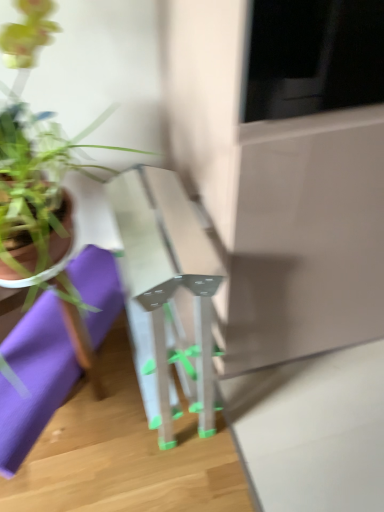
Based on the photo, what is the approximate width of purple fabric at lower left?

purple fabric at lower left is 24.66 inches in width.

Image resolution: width=384 pixels, height=512 pixels. Describe the element at coordinates (34, 379) in the screenshot. I see `purple fabric at lower left` at that location.

What are the coordinates of `transparent plastic table at center` in the screenshot? It's located at pyautogui.click(x=169, y=283).

Is purple fabric at lower left surrounding transparent plastic table at center?

No, transparent plastic table at center is not surrounded by purple fabric at lower left.

Is point (94, 319) positioned before point (196, 332)?

No, it is behind (196, 332).

Considering the relative sizes of purple fabric at lower left and transparent plastic table at center in the image provided, is purple fabric at lower left smaller than transparent plastic table at center?

Yes.

How many degrees apart are the facing directions of purple fabric at lower left and transparent plastic table at center?

The facing directions of purple fabric at lower left and transparent plastic table at center are 36.9 degrees apart.

Considering the sizes of objects green matte plant pot at left and transparent plastic table at center in the image provided, who is taller, green matte plant pot at left or transparent plastic table at center?

Standing taller between the two is transparent plastic table at center.

Would you say transparent plastic table at center is part of green matte plant pot at left's contents?

No, transparent plastic table at center is located outside of green matte plant pot at left.

How many degrees apart are the facing directions of green matte plant pot at left and transparent plastic table at center?

The angle between the facing direction of green matte plant pot at left and the facing direction of transparent plastic table at center is 0.475 degrees.

At what (x,y) coordinates should I click in order to perform the action: click on houseplant above the transparent plastic table at center (from the image's perspective). Please return your answer as a coordinate pair (x, y). This screenshot has width=384, height=512. Looking at the image, I should click on (103, 78).

Is point (207, 383) closer or farther from the camera than point (80, 124)?

Point (207, 383) is closer to the camera than point (80, 124).

In the image, is transparent plastic table at center positioned in front of or behind green matte plant pot at left?

transparent plastic table at center is behind green matte plant pot at left.

Considering the relative sizes of transparent plastic table at center and green matte plant pot at left in the image provided, is transparent plastic table at center smaller than green matte plant pot at left?

No.

In the scene shown: Is transparent plastic table at center facing away from green matte plant pot at left?

transparent plastic table at center is not turned away from green matte plant pot at left.

Looking at this image, considering the relative sizes of transparent plastic table at center and purple fabric at lower left in the image provided, is transparent plastic table at center taller than purple fabric at lower left?

Yes.

Is the surface of transparent plastic table at center in direct contact with purple fabric at lower left?

No, transparent plastic table at center is not next to purple fabric at lower left.

Which object is wider, transparent plastic table at center or purple fabric at lower left?

Wider between the two is transparent plastic table at center.

Is transparent plastic table at center at the right side of purple fabric at lower left?

Indeed, transparent plastic table at center is positioned on the right side of purple fabric at lower left.

Choose the correct answer: Is purple fabric at lower left inside green matte plant pot at left or outside it?

purple fabric at lower left is not enclosed by green matte plant pot at left.

Is purple fabric at lower left further to camera compared to green matte plant pot at left?

Yes, purple fabric at lower left is further from the viewer.

Is the surface of purple fabric at lower left in direct contact with green matte plant pot at left?

purple fabric at lower left is not next to green matte plant pot at left, and they're not touching.

Does purple fabric at lower left turn towards green matte plant pot at left?

No, purple fabric at lower left does not turn towards green matte plant pot at left.

From the image's perspective, does green matte plant pot at left appear higher than purple fabric at lower left?

Yes, from the image's perspective, green matte plant pot at left is above purple fabric at lower left.

How different are the orientations of green matte plant pot at left and purple fabric at lower left in degrees?

The angular difference between green matte plant pot at left and purple fabric at lower left is 36.4 degrees.

Is green matte plant pot at left not close to purple fabric at lower left?

No, green matte plant pot at left is not far away from purple fabric at lower left.

The width and height of the screenshot is (384, 512). Identify the location of table in front of the purple fabric at lower left. (169, 283).

The height and width of the screenshot is (512, 384). What are the coordinates of `houseplant that is above the transparent plastic table at center (from the image's perspective)` in the screenshot? It's located at (103, 78).

Looking at the image, which one is located closer to purple fabric at lower left, green matte plant pot at left or transparent plastic table at center?

transparent plastic table at center lies closer to purple fabric at lower left than the other object.

Looking at the image, which one is located closer to transparent plastic table at center, purple fabric at lower left or green matte plant pot at left?

purple fabric at lower left is positioned closer to the anchor transparent plastic table at center.

Based on their spatial positions, is transparent plastic table at center or purple fabric at lower left further from green matte plant pot at left?

transparent plastic table at center is positioned further to the anchor green matte plant pot at left.

When comparing their distances from transparent plastic table at center, does green matte plant pot at left or purple fabric at lower left seem closer?

The object closer to transparent plastic table at center is purple fabric at lower left.

Considering their positions, is transparent plastic table at center positioned closer to purple fabric at lower left than green matte plant pot at left?

Based on the image, transparent plastic table at center appears to be nearer to purple fabric at lower left.

Considering their positions, is purple fabric at lower left positioned closer to green matte plant pot at left than transparent plastic table at center?

The object closer to green matte plant pot at left is purple fabric at lower left.

I want to click on table located between green matte plant pot at left and purple fabric at lower left in the depth direction, so click(169, 283).